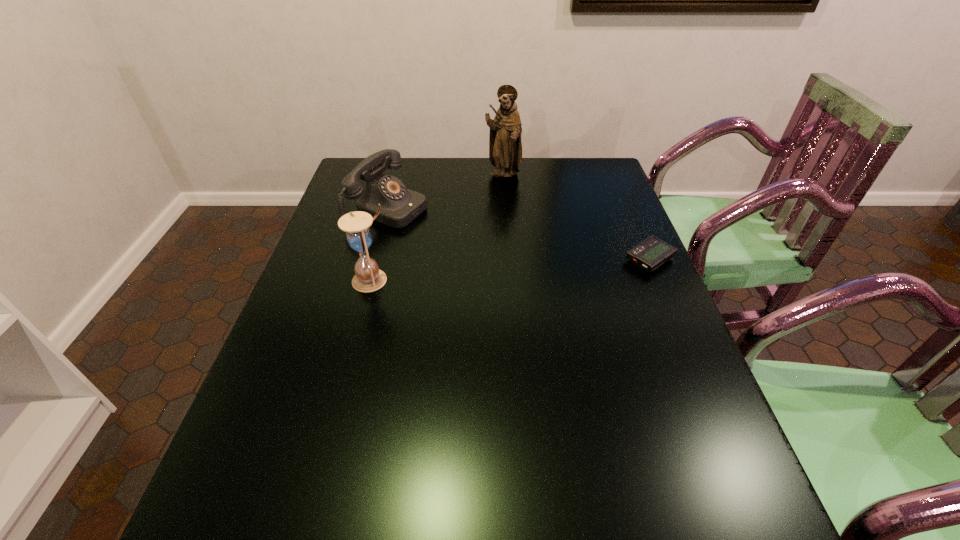
You are a GUI agent. You are given a task and a screenshot of the screen. Output one action in this format:
    pyautogui.click(x=<x>, y=<y>)
    Task: Click on the free spot between the hourglass and the telephone
    Image resolution: width=960 pixels, height=540 pixels.
    Given the screenshot: What is the action you would take?
    pyautogui.click(x=380, y=244)

At what (x,y) coordinates should I click in order to perform the action: click on free space between the second tallest object and the shortest object. Please return your answer as a coordinate pair (x, y). Looking at the image, I should click on (511, 270).

Where is `unoccupied position between the third nearest object and the second tallest object`? unoccupied position between the third nearest object and the second tallest object is located at coordinates (380, 244).

Find the location of `empty space between the figurine and the telephone`. empty space between the figurine and the telephone is located at coordinates (445, 192).

The image size is (960, 540). I want to click on free area in between the second farthest object and the beeper, so click(519, 234).

The height and width of the screenshot is (540, 960). Find the location of `vacant space that is in between the telephone and the rightmost object`. vacant space that is in between the telephone and the rightmost object is located at coordinates pos(519,234).

Where is `object that stands as the third closest to the second shortest object`? object that stands as the third closest to the second shortest object is located at coordinates (651, 253).

Image resolution: width=960 pixels, height=540 pixels. I want to click on object identified as the third closest to the tallest object, so click(368, 277).

Where is `vacant space that satisfies the following two spatial constraints: 1. on the front side of the second shortest object; 2. on the left side of the beeper`? Image resolution: width=960 pixels, height=540 pixels. vacant space that satisfies the following two spatial constraints: 1. on the front side of the second shortest object; 2. on the left side of the beeper is located at coordinates (375, 260).

I want to click on vacant space that satisfies the following two spatial constraints: 1. on the front side of the rightmost object; 2. on the right side of the third tallest object, so click(375, 260).